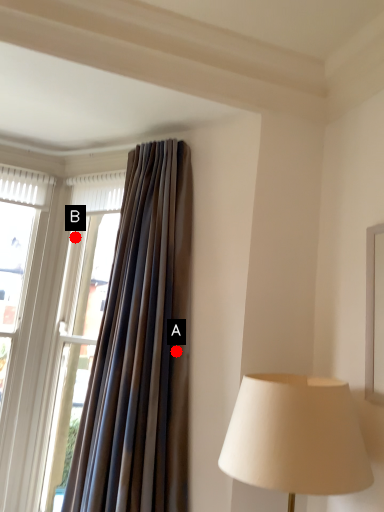
Question: Two points are circled on the image, labeled by A and B beside each circle. Among these points, which one is nearest to the camera?

Choices:
 (A) A is closer
 (B) B is closer

Answer: (A)